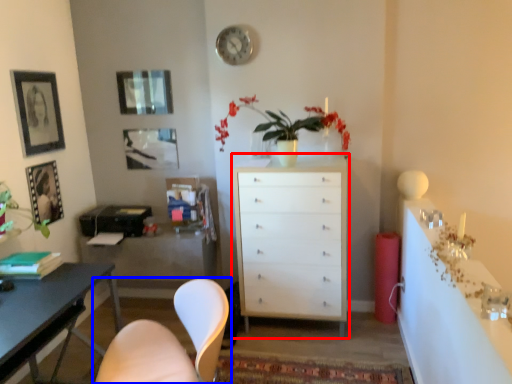
Question: Among these objects, which one is nearest to the camera, chest of drawers (highlighted by a red box) or chair (highlighted by a blue box)?

Choices:
 (A) chest of drawers
 (B) chair

Answer: (B)